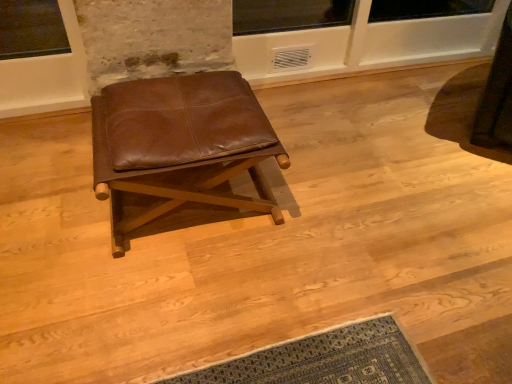
I want to click on brown leather stool at center, so click(x=180, y=144).

This screenshot has width=512, height=384. What do you see at coordinates (180, 144) in the screenshot? I see `brown leather stool at center` at bounding box center [180, 144].

Locate an element on the screen. This screenshot has height=384, width=512. brown leather stool at center is located at coordinates (x=180, y=144).